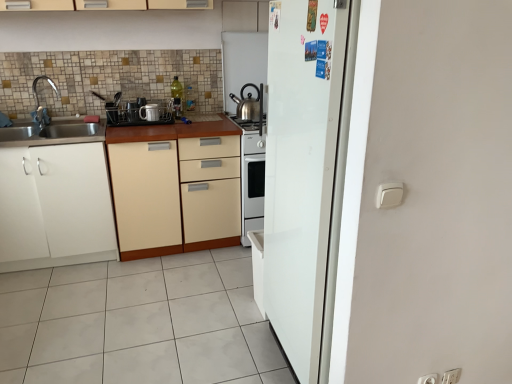
The height and width of the screenshot is (384, 512). What are the coordinates of `free point in front of metallic silver kettle at upper center` in the screenshot? It's located at (247, 123).